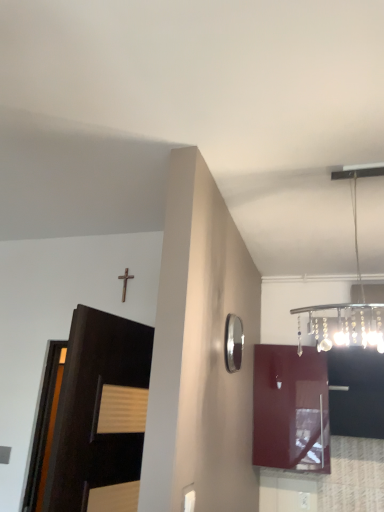
Question: Can you confirm if dark wood door at left is shorter than silver/metallic mirror at upper right?

Choices:
 (A) yes
 (B) no

Answer: (B)

Question: Can you confirm if dark wood door at left is bigger than silver/metallic mirror at upper right?

Choices:
 (A) yes
 (B) no

Answer: (A)

Question: From the image's perspective, is dark wood door at left below silver/metallic mirror at upper right?

Choices:
 (A) yes
 (B) no

Answer: (A)

Question: Considering the relative positions of dark wood door at left and silver/metallic mirror at upper right in the image provided, is dark wood door at left to the left of silver/metallic mirror at upper right from the viewer's perspective?

Choices:
 (A) yes
 (B) no

Answer: (A)

Question: Is silver/metallic mirror at upper right located within dark wood door at left?

Choices:
 (A) yes
 (B) no

Answer: (B)

Question: Considering the relative sizes of dark wood door at left and silver/metallic mirror at upper right in the image provided, is dark wood door at left thinner than silver/metallic mirror at upper right?

Choices:
 (A) no
 (B) yes

Answer: (A)

Question: Is black glossy cabinet at upper right, marked as the second cabinetry in a left-to-right arrangement, wider than silver/metallic mirror at upper right?

Choices:
 (A) no
 (B) yes

Answer: (B)

Question: Is black glossy cabinet at upper right, marked as the first cabinetry in a right-to-left arrangement, shorter than silver/metallic mirror at upper right?

Choices:
 (A) yes
 (B) no

Answer: (A)

Question: From the image's perspective, is black glossy cabinet at upper right, marked as the first cabinetry in a right-to-left arrangement, under silver/metallic mirror at upper right?

Choices:
 (A) yes
 (B) no

Answer: (A)

Question: From a real-world perspective, is black glossy cabinet at upper right, marked as the first cabinetry in a right-to-left arrangement, under silver/metallic mirror at upper right?

Choices:
 (A) no
 (B) yes

Answer: (B)

Question: Does black glossy cabinet at upper right, marked as the first cabinetry in a right-to-left arrangement, have a smaller size compared to silver/metallic mirror at upper right?

Choices:
 (A) yes
 (B) no

Answer: (B)

Question: Considering the relative sizes of black glossy cabinet at upper right, marked as the second cabinetry in a left-to-right arrangement, and silver/metallic mirror at upper right in the image provided, is black glossy cabinet at upper right, marked as the second cabinetry in a left-to-right arrangement, bigger than silver/metallic mirror at upper right?

Choices:
 (A) no
 (B) yes

Answer: (B)

Question: Is dark wood door at left oriented towards black glossy cabinet at upper right, marked as the second cabinetry in a left-to-right arrangement?

Choices:
 (A) yes
 (B) no

Answer: (B)